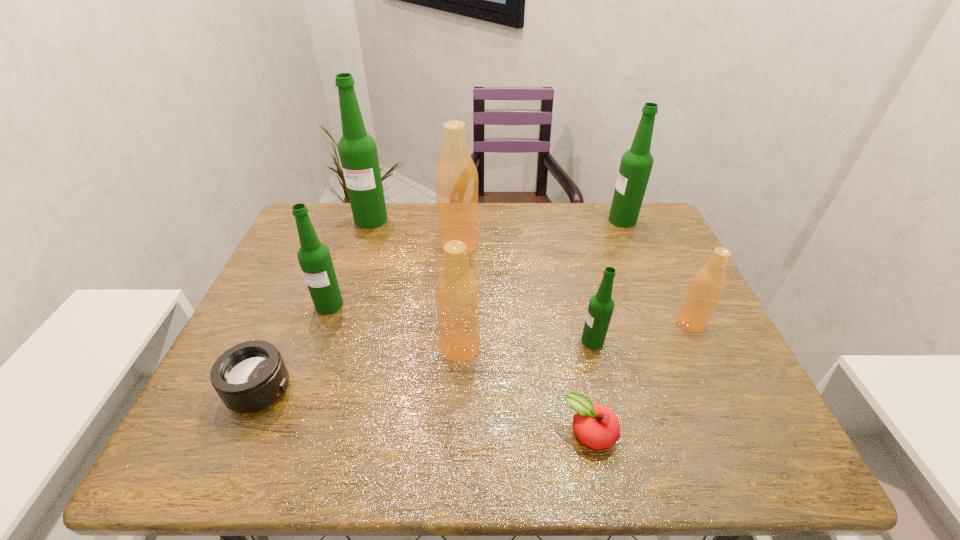
You are a GUI agent. You are given a task and a screenshot of the screen. Output one action in this format:
    pyautogui.click(x=<x>, y=<y>)
    Task: Click on the telephoto lens
    This screenshot has width=960, height=540.
    Given the screenshot: What is the action you would take?
    pyautogui.click(x=249, y=377)

Identify the location of apple. (596, 426).

Locate an element on the screen. The height and width of the screenshot is (540, 960). vacant space located on the label of the biggest green beer bottle is located at coordinates (340, 318).

Where is `free point located 0.180m on the label of the third smallest green beer bottle`? Image resolution: width=960 pixels, height=540 pixels. free point located 0.180m on the label of the third smallest green beer bottle is located at coordinates (553, 220).

Identify the location of vacant area situated 0.370m on the label of the third smallest green beer bottle. The width and height of the screenshot is (960, 540). (494, 220).

Where is `vacant area situated 0.120m on the label of the third smallest green beer bottle`? The height and width of the screenshot is (540, 960). vacant area situated 0.120m on the label of the third smallest green beer bottle is located at coordinates (571, 220).

At what (x,y) coordinates should I click in order to perform the action: click on blank area located on the left of the biggest tan beer bottle. Please return your answer as a coordinate pair (x, y). Image resolution: width=960 pixels, height=540 pixels. Looking at the image, I should click on (306, 245).

Where is `free space located 0.150m on the label of the third biggest green beer bottle`? The image size is (960, 540). free space located 0.150m on the label of the third biggest green beer bottle is located at coordinates (308, 363).

The image size is (960, 540). Identify the location of vacant space located 0.290m on the left of the second smallest tan beer bottle. (317, 347).

Identify the location of free space located 0.050m on the label of the nearest green beer bottle. (561, 341).